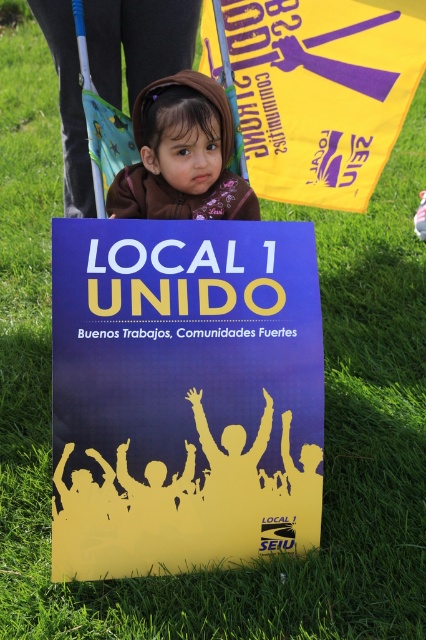
Measure the distance from blue paper poster at center to yellow matte poster at center.

The distance of blue paper poster at center from yellow matte poster at center is 1.46 meters.

Is point (160, 528) closer to viewer compared to point (423, 44)?

Yes, it is in front of point (423, 44).

Who is more distant from viewer, (140, 278) or (253, 154)?

Point (253, 154)

Locate an element on the screen. This screenshot has width=426, height=640. blue paper poster at center is located at coordinates coord(184,394).

Between yellow matte poster at center and brown fabric at center, which one has more height?

Standing taller between the two is yellow matte poster at center.

Can you confirm if yellow matte poster at center is positioned above brown fabric at center?

Yes.

Identify the location of yellow matte poster at center. (322, 92).

Who is more forward, (201, 540) or (216, 97)?

Point (201, 540) is in front.

In the scene shown: Which of these two, blue paper poster at center or brown fabric at center, stands shorter?

brown fabric at center is shorter.

You are a GUI agent. You are given a task and a screenshot of the screen. Output one action in this format:
    pyautogui.click(x=<x>, y=<y>)
    Task: Click on the blue paper poster at center
    The image size is (426, 640).
    Given the screenshot: What is the action you would take?
    pyautogui.click(x=184, y=394)